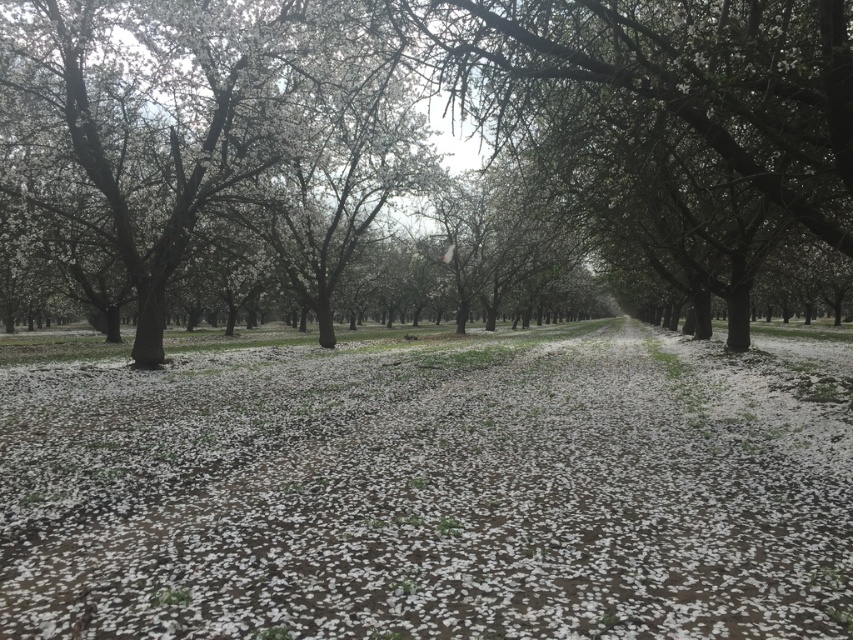
You are standing in the orchard depicted in the scene. There is a specific point marked at coordinates point (x=432, y=492). What object is located at this point?

The white matte petals at center are located at point (x=432, y=492).

You are an artist planning to paint the orchard scene. You want to ensure the scale of the white matte petals at center and the white blossoms at center is accurate. Which object should you paint smaller?

The white matte petals at center should be painted smaller since they are smaller in size compared to the white blossoms at center.

You are standing in the orchard and see both the white matte petals at center and the white blossoms at center. Which of these two objects is nearer to you?

The white matte petals at center are closer to the viewer than the white blossoms at center.